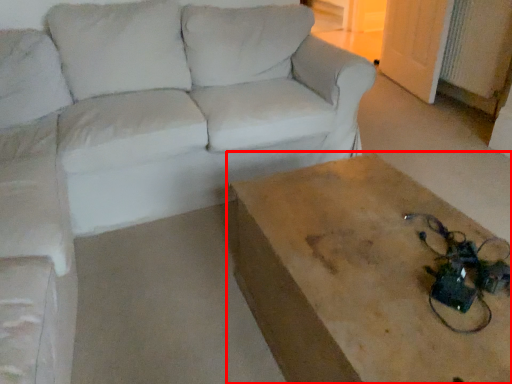
Question: From the image's perspective, where is table (annotated by the red box) located relative to studio couch?

Choices:
 (A) below
 (B) above

Answer: (A)